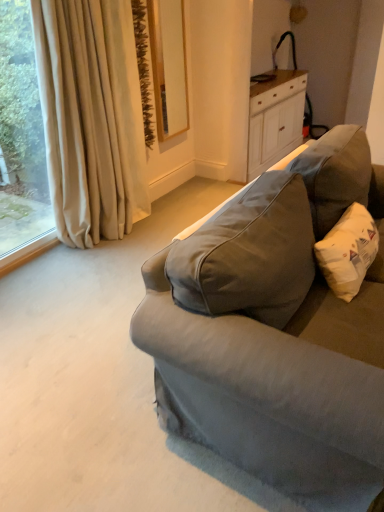
Locate an element on the screen. This screenshot has width=384, height=512. free space in front of beige fabric curtain at left is located at coordinates (93, 270).